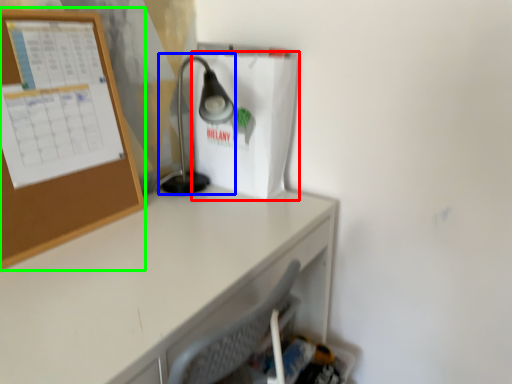
Question: Estimate the real-world distances between objects in this image. Which object is closer to paper bag (highlighted by a red box), lamp (highlighted by a blue box) or bulletin board (highlighted by a green box)?

Choices:
 (A) lamp
 (B) bulletin board

Answer: (A)